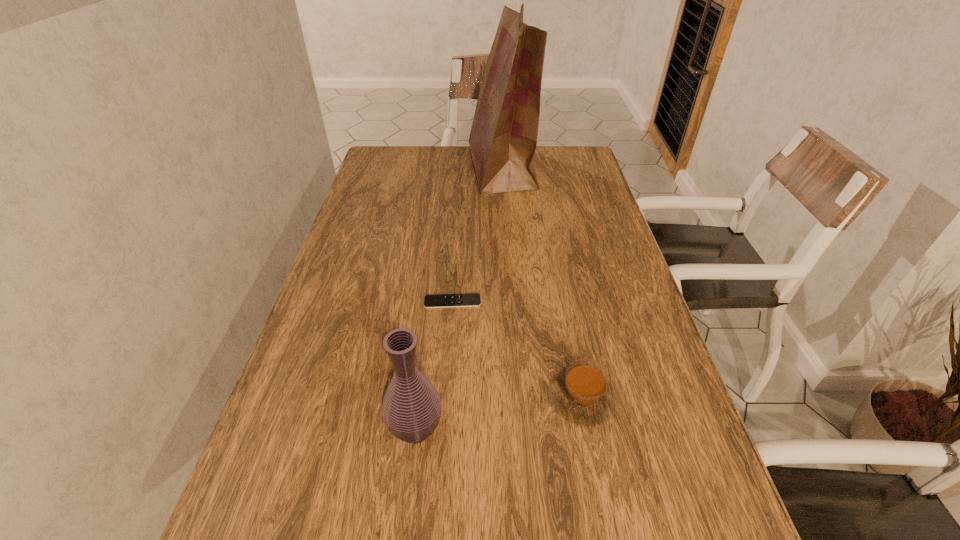
This screenshot has height=540, width=960. In order to click on vacant space situated on the left of the second shortest object in this screenshot , I will do `click(517, 399)`.

Where is `free location located on the front of the shortest object`? The height and width of the screenshot is (540, 960). free location located on the front of the shortest object is located at coordinates click(x=447, y=377).

Find the location of `object present at the far edge`. object present at the far edge is located at coordinates (503, 138).

What are the coordinates of `object that is at the right edge` in the screenshot? It's located at (582, 394).

Locate an element on the screen. vacant space at the far edge is located at coordinates (418, 168).

In the image, there is a desktop. Identify the location of vacant region at the left edge. (385, 185).

Identify the location of blank space at the right edge of the desktop. The height and width of the screenshot is (540, 960). (589, 246).

In the image, there is a desktop. At what (x,y) coordinates should I click in order to perform the action: click on vacant space at the far left corner. Please return your answer as a coordinate pair (x, y). Image resolution: width=960 pixels, height=540 pixels. Looking at the image, I should click on (385, 167).

The height and width of the screenshot is (540, 960). Find the location of `free area in between the third nearest object and the grocery bag`. free area in between the third nearest object and the grocery bag is located at coordinates [x=477, y=235].

Identify the location of free space between the vase and the remote control. This screenshot has height=540, width=960. (434, 366).